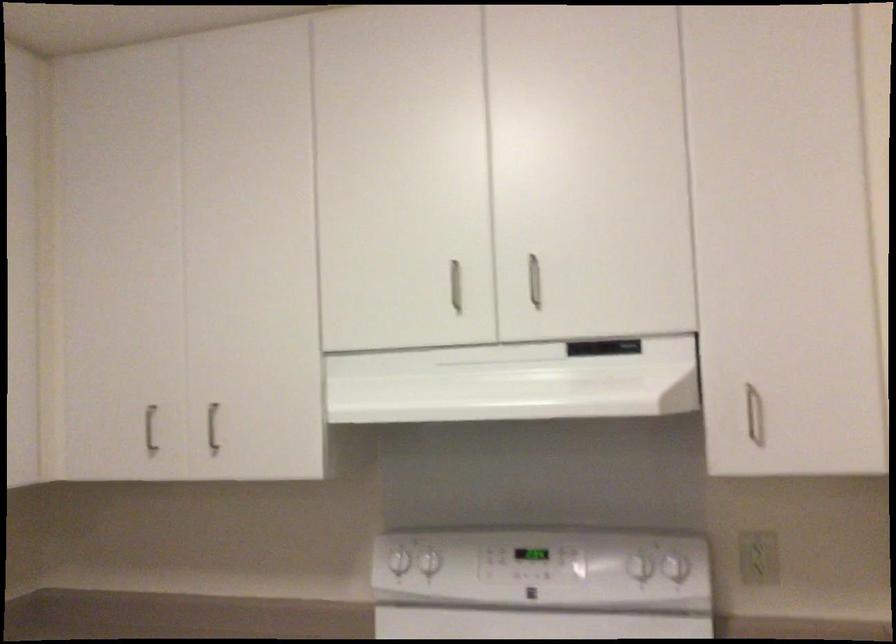
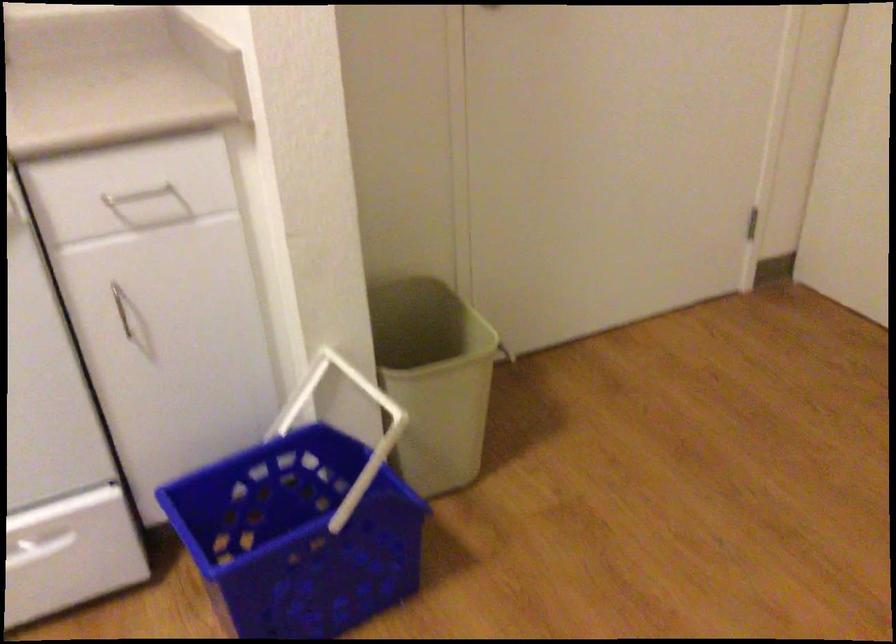
Based on the continuous images, in which direction is the camera rotating?

The camera rotated toward right-down.